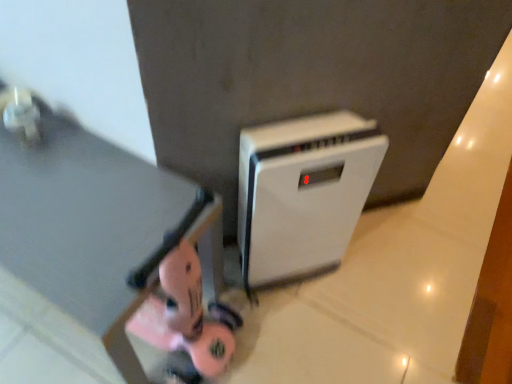
I want to click on free space above matte black table at lower left (from a real-world perspective), so click(68, 196).